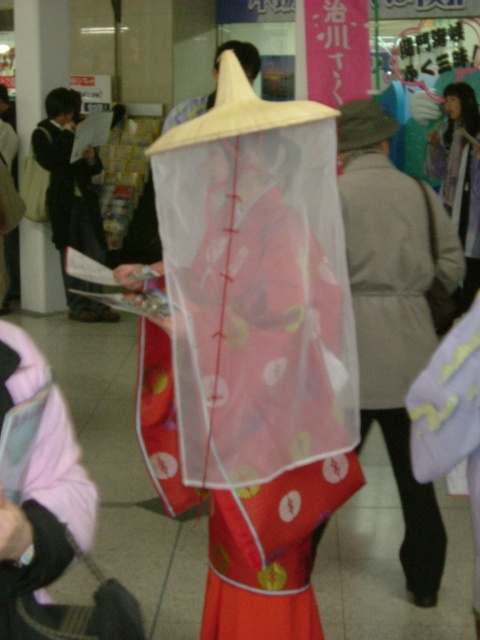
You are a photographer at a cultural event and need to capture both the matte red kimono at center and the matte black jacket at left in a single frame. Based on their sizes, which object should you focus on first to ensure both are clearly visible in the photo?

The matte red kimono at center is smaller than the matte black jacket at left, so you should focus on the matte black jacket at left first since it is larger and will be easier to capture clearly in the frame.

You are standing in front of the person wearing the red kimono with the white netting. You notice two points marked on their clothing. The first point is at coordinates point (x=94, y=172) and the second is at point (x=432, y=132). From your perspective, which point is closer to you?

Point (x=94, y=172) is in front of point (x=432, y=132), so the first point is closer to you.